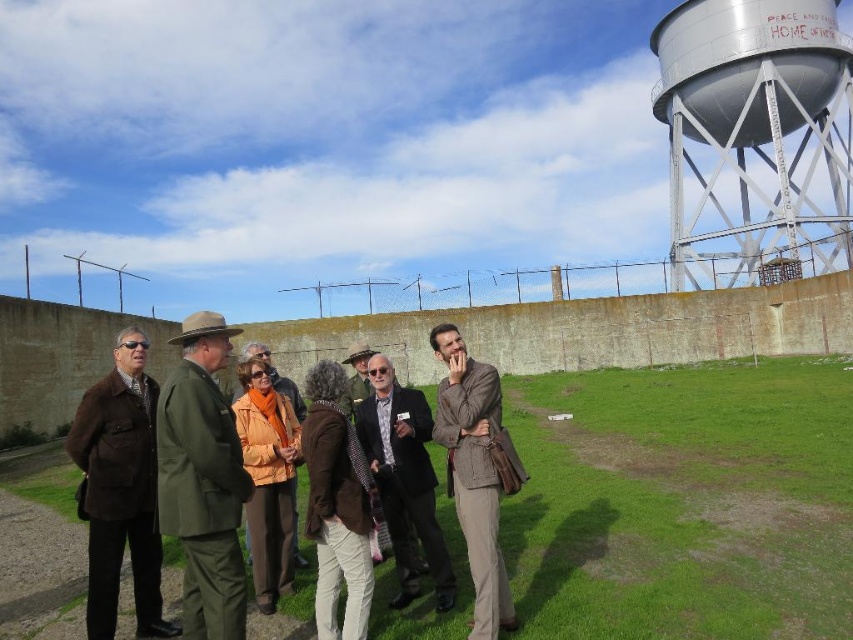
You are a photographer trying to capture a group photo of the green uniform at center and the orange fabric jacket at center. To ensure both subjects are in focus, you need to know their relative positions. Which subject is closer to the camera?

The green uniform at center is closer to the camera because it is in front of the orange fabric jacket at center.